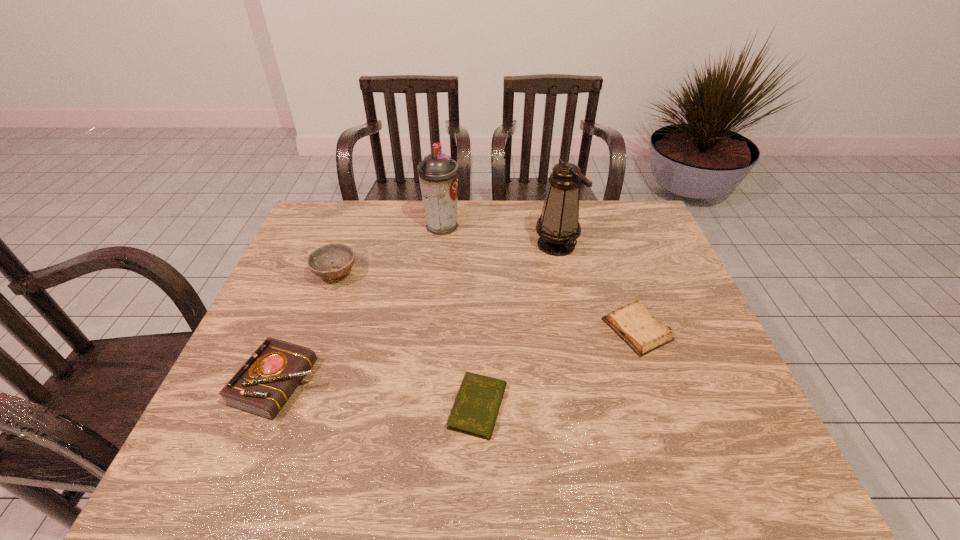
The width and height of the screenshot is (960, 540). I want to click on free spot located 0.280m on the front of the bowl, so click(300, 370).

The height and width of the screenshot is (540, 960). I want to click on vacant space situated on the right of the leftmost diary, so coord(348,383).

Where is `vacant space located 0.050m on the right of the rightmost diary`? The width and height of the screenshot is (960, 540). vacant space located 0.050m on the right of the rightmost diary is located at coordinates (688, 329).

What are the coordinates of `free space located on the right of the shortest diary` in the screenshot? It's located at (589, 407).

Image resolution: width=960 pixels, height=540 pixels. Identify the location of aerosol can positioned at the far edge. click(x=438, y=174).

Where is `oil lamp at the far edge`? This screenshot has width=960, height=540. oil lamp at the far edge is located at coordinates (558, 226).

Where is `bowl located in the left edge section of the desktop`? bowl located in the left edge section of the desktop is located at coordinates (319, 261).

Identify the location of diary located at the left edge. [263, 384].

You are a GUI agent. You are given a task and a screenshot of the screen. Output one action in this format:
    pyautogui.click(x=<x>, y=<y>)
    Task: Click on the object present at the right edge
    This screenshot has width=960, height=540.
    Given the screenshot: What is the action you would take?
    pyautogui.click(x=633, y=323)

The width and height of the screenshot is (960, 540). I want to click on free space at the far edge of the desktop, so click(495, 230).